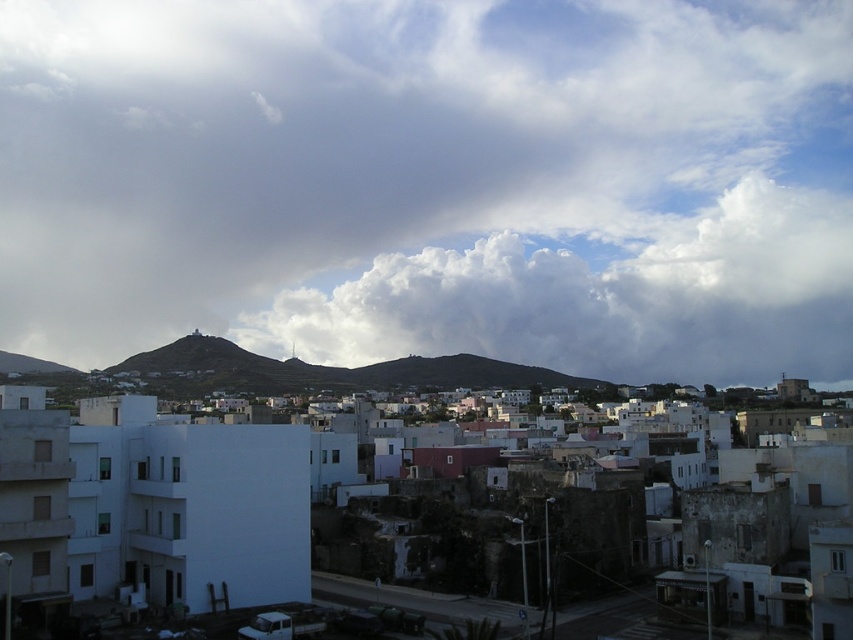
You are an airplane pilot flying over the urban area. You notice two white fluffy clouds in the sky. Which cloud is closer to your airplane? The white fluffy cloud at upper center or the white fluffy cloud at center?

The white fluffy cloud at upper center is closer to your airplane because it is in front of the white fluffy cloud at center, which is positioned behind it.

In the scene shown: You are standing at a point in the urban area and want to know how far the point at coordinates point (144, 16) is from you. Can you determine the distance?

The distance between you and point (144, 16) is 571.14 meters.